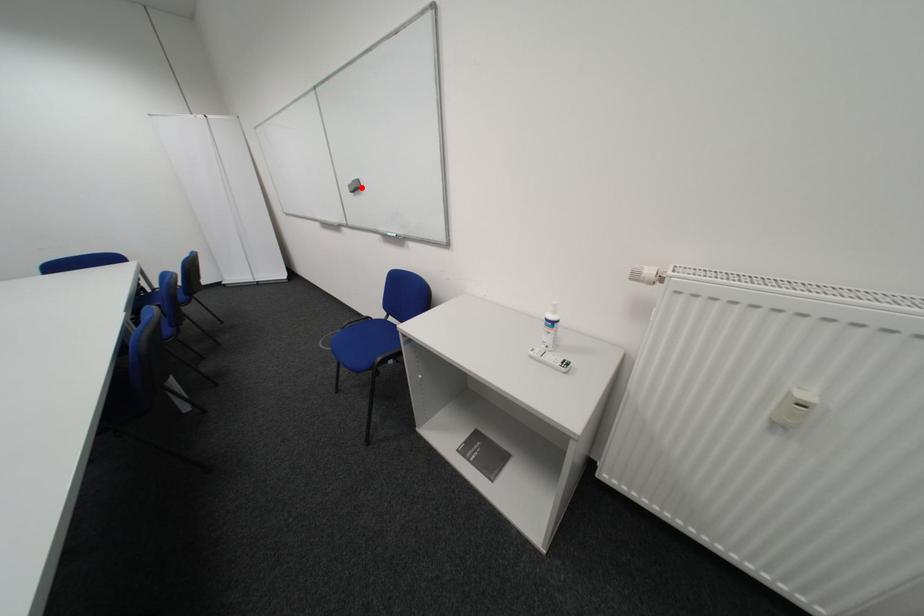
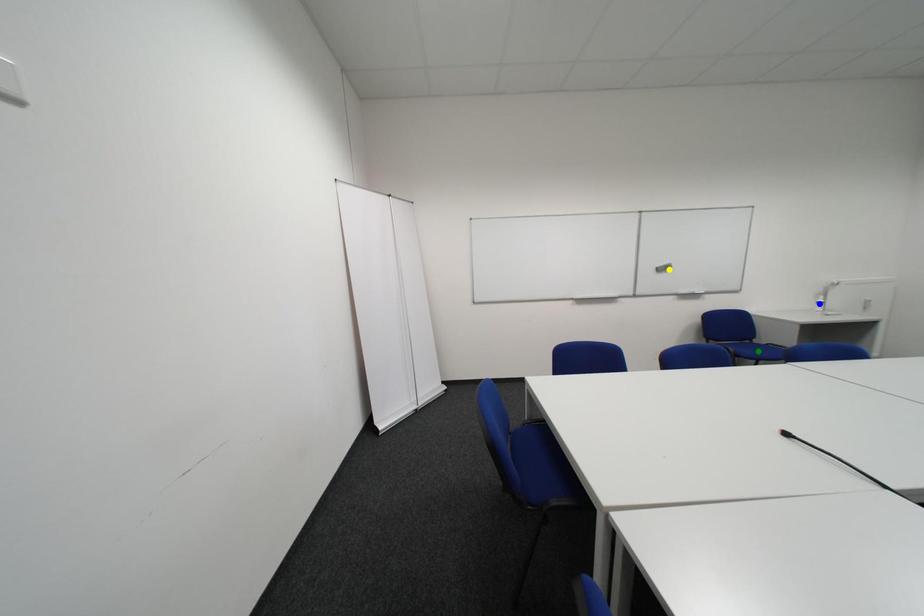
Question: I am providing you with two images of the same scene from different viewpoints. A red point is marked on the first image. You are given multiple points on the second image. Can you choose the point in image 2 that corresponds to the point in image 1?

Choices:
 (A) yellow point
 (B) green point
 (C) blue point

Answer: (A)